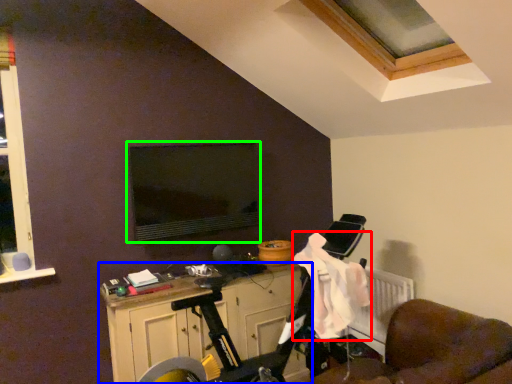
Question: Which object is positioned farthest from laundry (highlighted by a red box)? Select from cabinetry (highlighted by a blue box) and computer monitor (highlighted by a green box).

Choices:
 (A) cabinetry
 (B) computer monitor

Answer: (B)